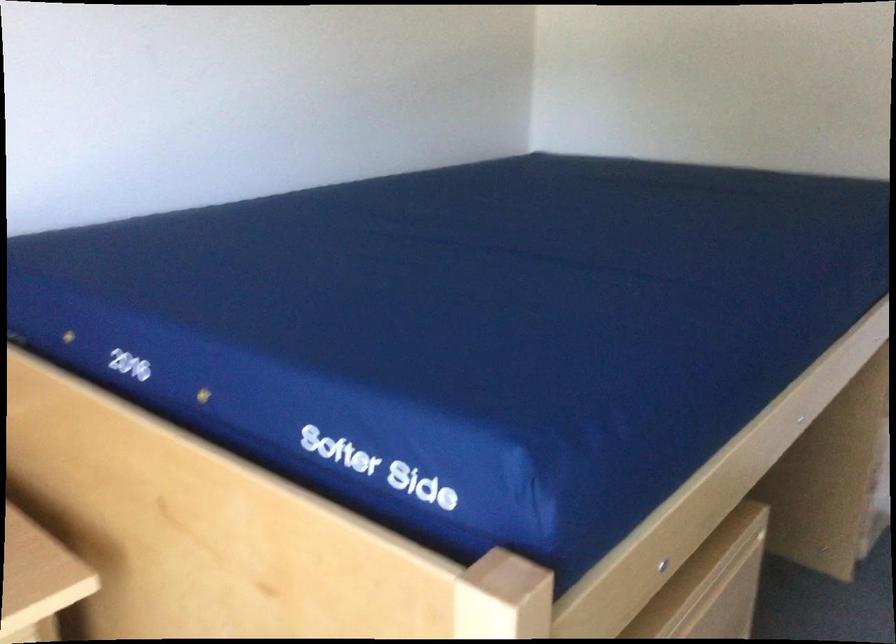
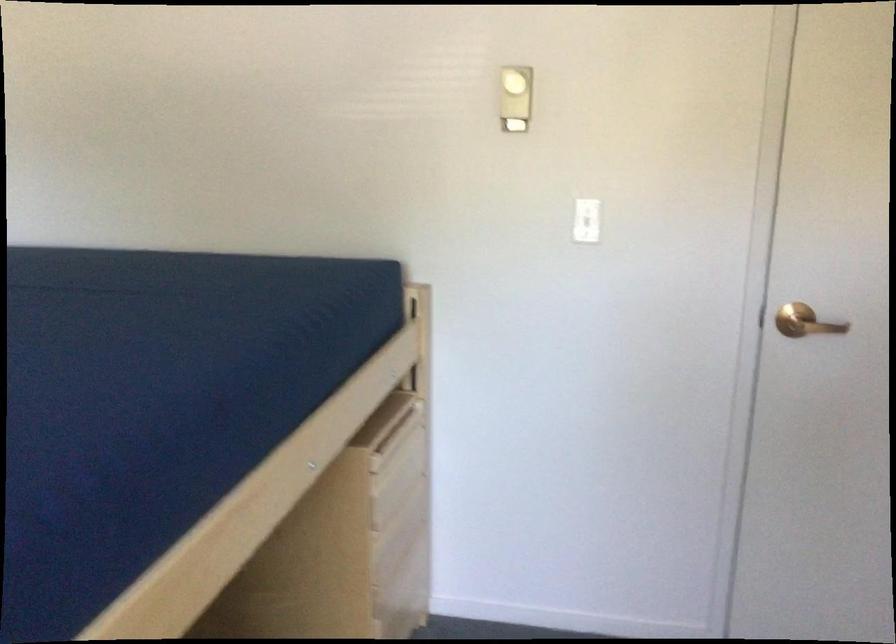
Question: The camera is either moving clockwise (left) or counter-clockwise (right) around the object. The first image is from the beginning of the video and the second image is from the end. Is the camera moving left or right when shooting the video?

Choices:
 (A) Left
 (B) Right

Answer: (A)